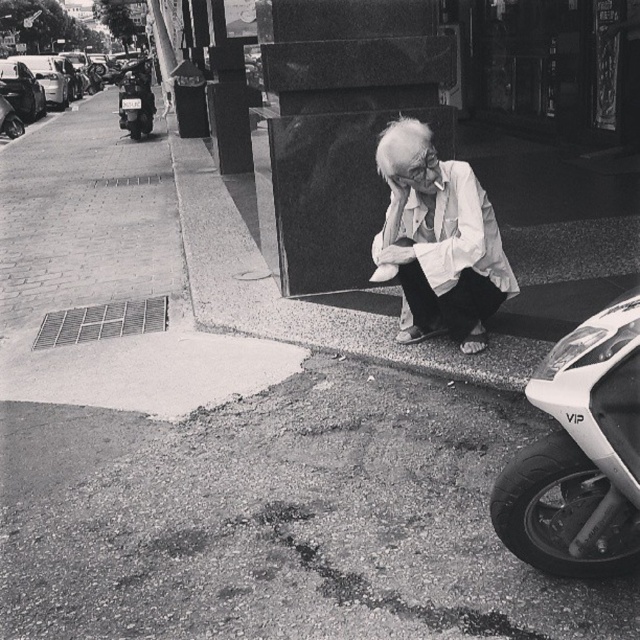
You are a delivery person who needs to park your 2.5 meter long motorcycle between the white glossy motorcycle at lower right and the shiny black motorcycle at left. Is there enough space between them to park your motorcycle?

The distance between the white glossy motorcycle at lower right and the shiny black motorcycle at left is 15.69 meters, which is more than enough space to park a 2.5 meter long motorcycle between them.

You are a pedestrian standing in the middle of the sidewalk. You see the white glossy motorcycle at lower right and the shiny black motorcycle at left. Which motorcycle is nearer to you?

The white glossy motorcycle at lower right is closer to the viewer than the shiny black motorcycle at left, so the white glossy motorcycle at lower right is nearer to you.

You are standing at the center of the street in this black and white photo. You see a point marked at coordinate (580, 454). Which object does this coordinate correspond to?

The point at coordinate (580, 454) corresponds to the white glossy motorcycle at lower right.